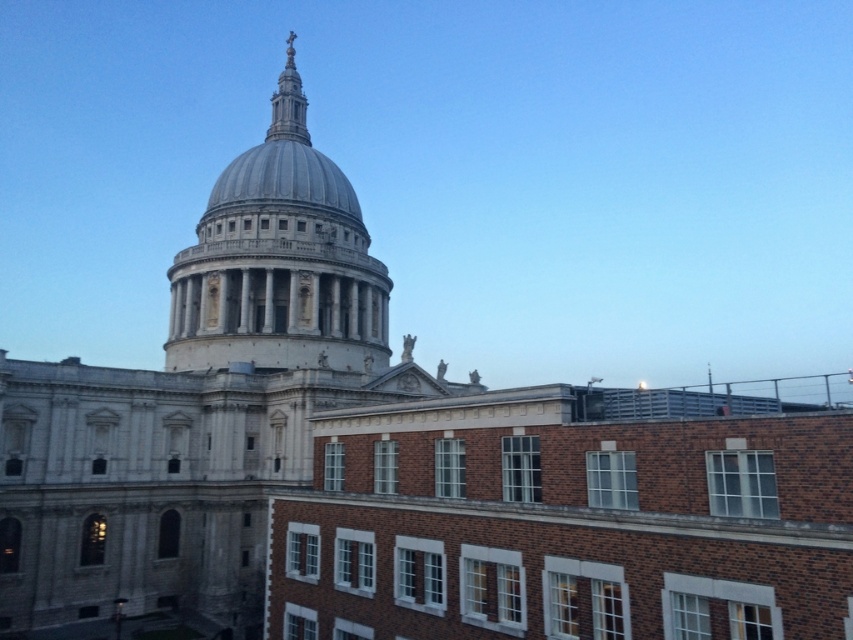
Who is lower down, white marble dome at center or gold metallic spire at upper center?

white marble dome at center

Between point (222, 314) and point (283, 72), which one is positioned in front?

Point (222, 314) is more forward.

The width and height of the screenshot is (853, 640). In order to click on white marble dome at center in this screenshot , I will do `click(279, 260)`.